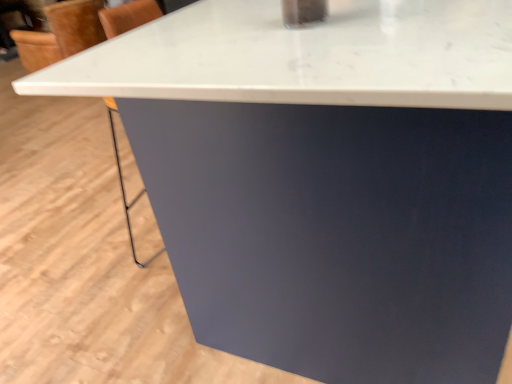
Measure the distance between point [36,54] and camera.

Point [36,54] and camera are 13.35 feet apart.

The width and height of the screenshot is (512, 384). I want to click on leather armchair at upper left, so click(61, 34).

What do you see at coordinates (61, 34) in the screenshot? I see `leather armchair at upper left` at bounding box center [61, 34].

Find the location of a particular element. The width and height of the screenshot is (512, 384). leather armchair at upper left is located at coordinates (61, 34).